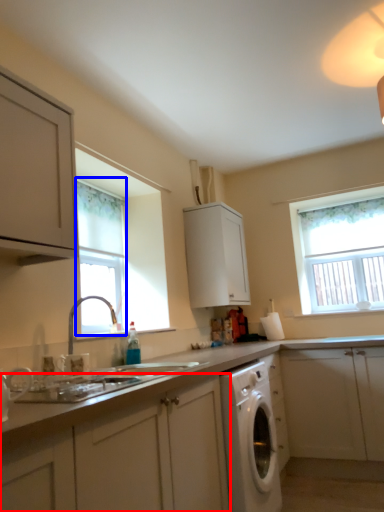
Question: Which point is closer to the camera, cabinetry (highlighted by a red box) or window (highlighted by a blue box)?

Choices:
 (A) cabinetry
 (B) window

Answer: (A)